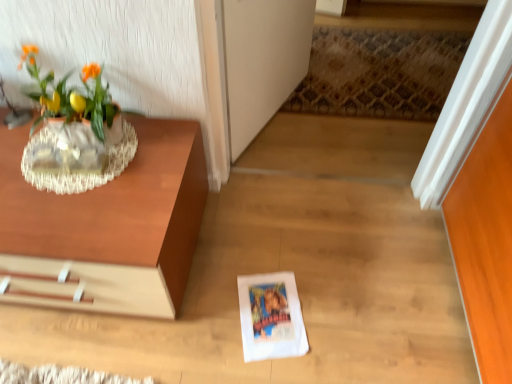
Identify the location of free space above clear glass vase at upper left (from a real-world perspective). (87, 165).